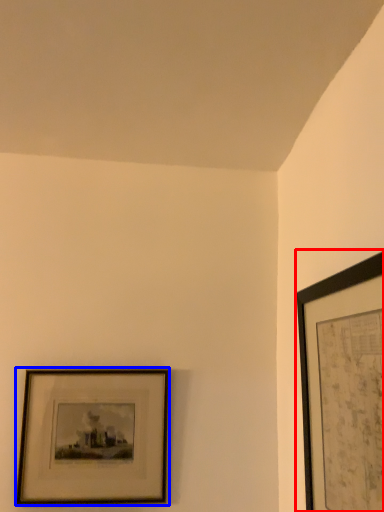
Question: Which object appears closest to the camera in this image, picture frame (highlighted by a red box) or picture frame (highlighted by a blue box)?

Choices:
 (A) picture frame
 (B) picture frame

Answer: (A)